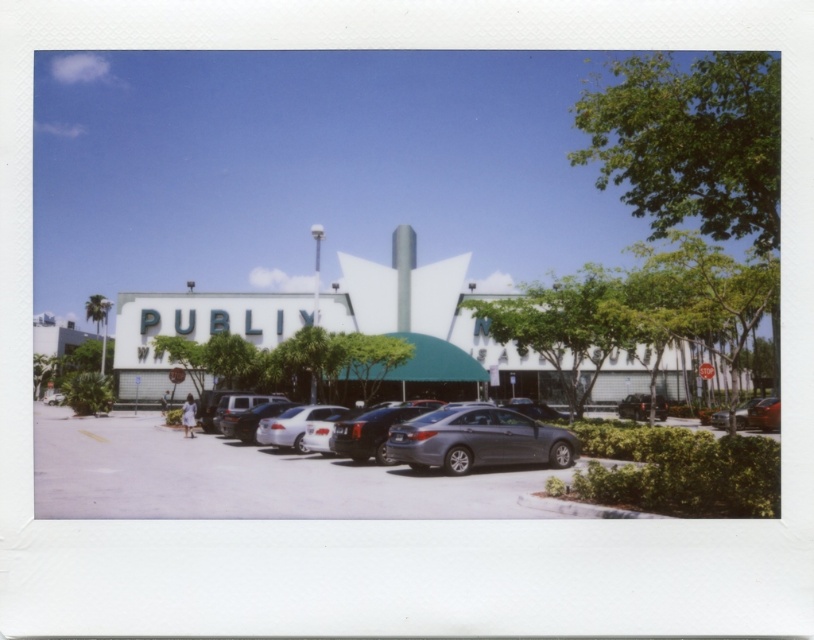
Consider the image. You are standing at the entrance of Publix and want to take a photo of two points in the parking lot. The first point is at coordinates point (729,467) and the second is at point (664,404). Which point will appear larger in your photo?

Point (729,467) will appear larger in the photo because it is closer to the camera than point (664,404).

You are standing at the Publix supermarket entrance and want to locate two specific points in the parking lot. The first point is at coordinates point (667, 451) and the second is at point (342, 454). Which point is closer to you?

Point (667, 451) is closer to the viewer than point (342, 454).